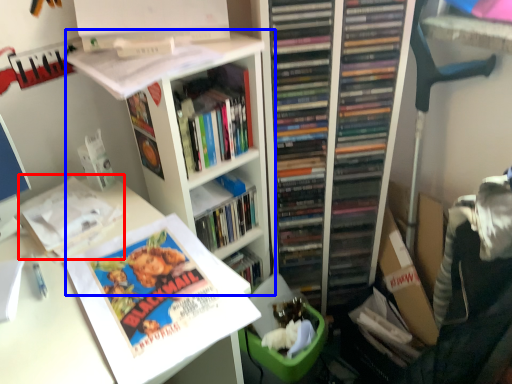
Question: Which object appears farthest to the camera in this image, book (highlighted by a red box) or bookshelf (highlighted by a blue box)?

Choices:
 (A) book
 (B) bookshelf

Answer: (A)